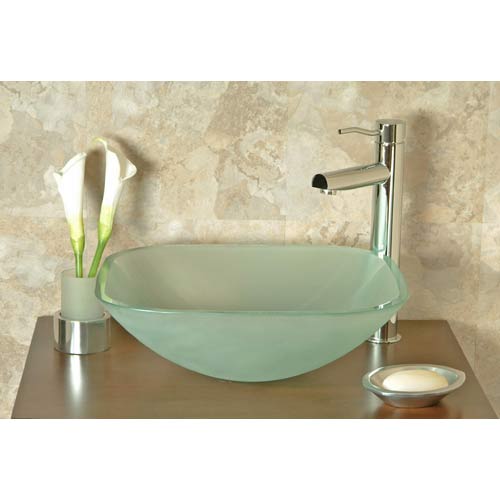
Find the location of a particular element. The height and width of the screenshot is (500, 500). sink is located at coordinates (255, 299).